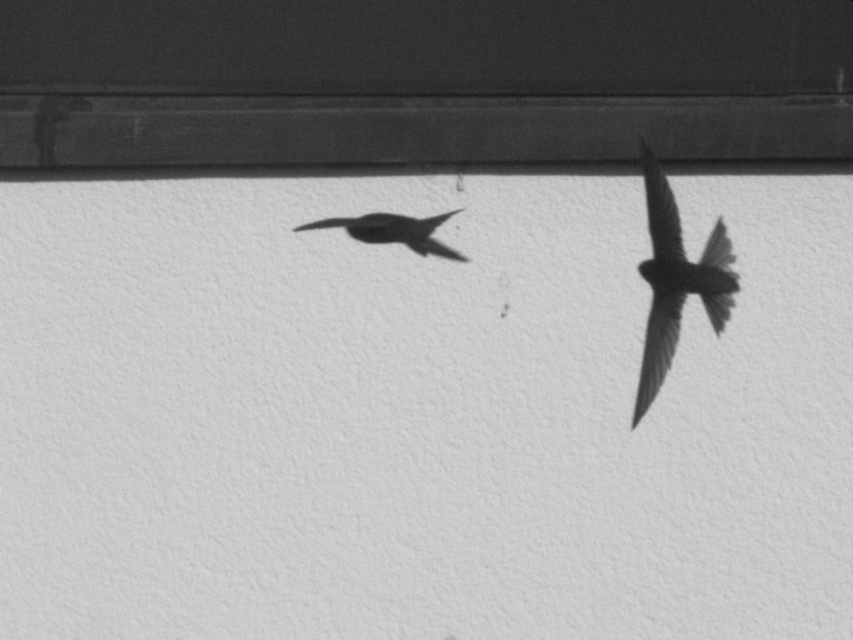
You are a photographer analyzing this black and white photo. You notice two birds in flight against a textured wall. The silvery metallic bird at right and the smooth black bird at center. Which bird is positioned more to the right side of the image?

The silvery metallic bird at right is positioned more to the right side of the image compared to the smooth black bird at center as stated in the description.

You are an ornithologist analyzing the photograph. You need to locate the silvery metallic bird at right precisely. What are its coordinates in the image?

The silvery metallic bird at right is located at coordinates point (675, 280).